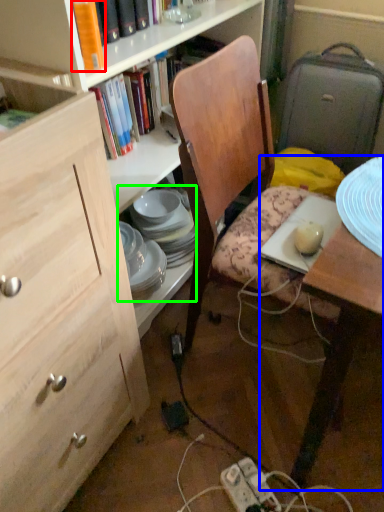
Question: Which object is the closest to the book (highlighted by a red box)? Choose among these: desk (highlighted by a blue box) or tableware (highlighted by a green box).

Choices:
 (A) desk
 (B) tableware

Answer: (A)